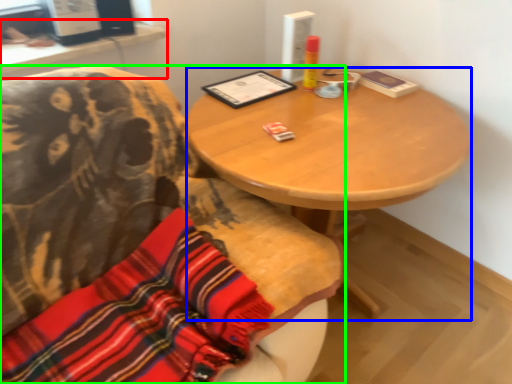
Question: Estimate the real-world distances between objects in this image. Which object is farther from computer desk (highlighted by a red box), desk (highlighted by a blue box) or chair (highlighted by a green box)?

Choices:
 (A) desk
 (B) chair

Answer: (A)